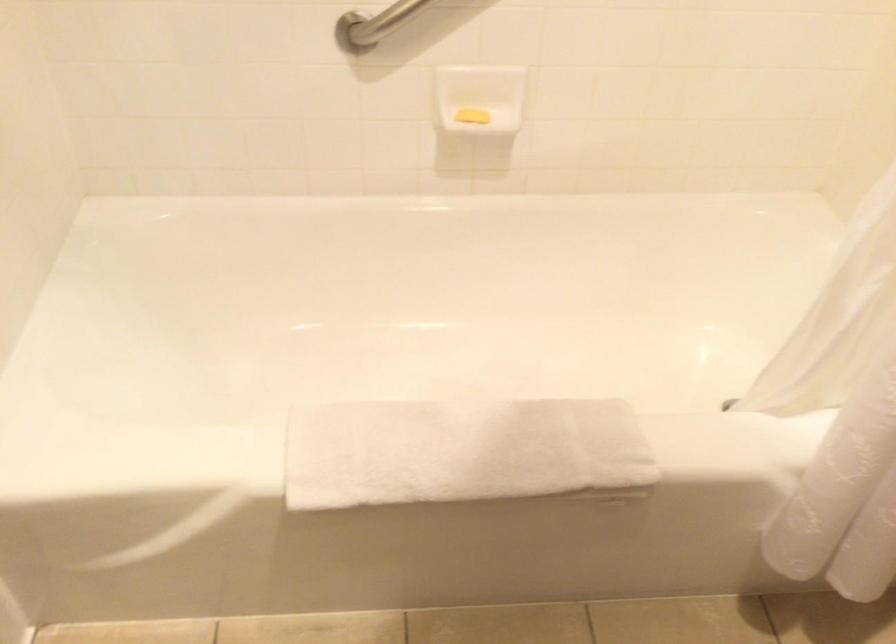
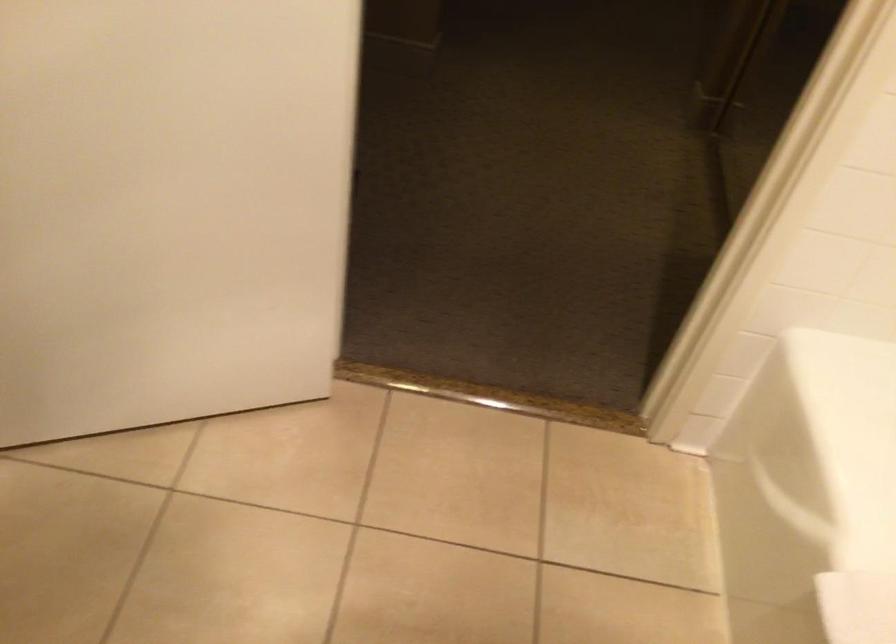
The first image is from the beginning of the video and the second image is from the end. How did the camera likely rotate when shooting the video?

The camera rotated toward left-down.